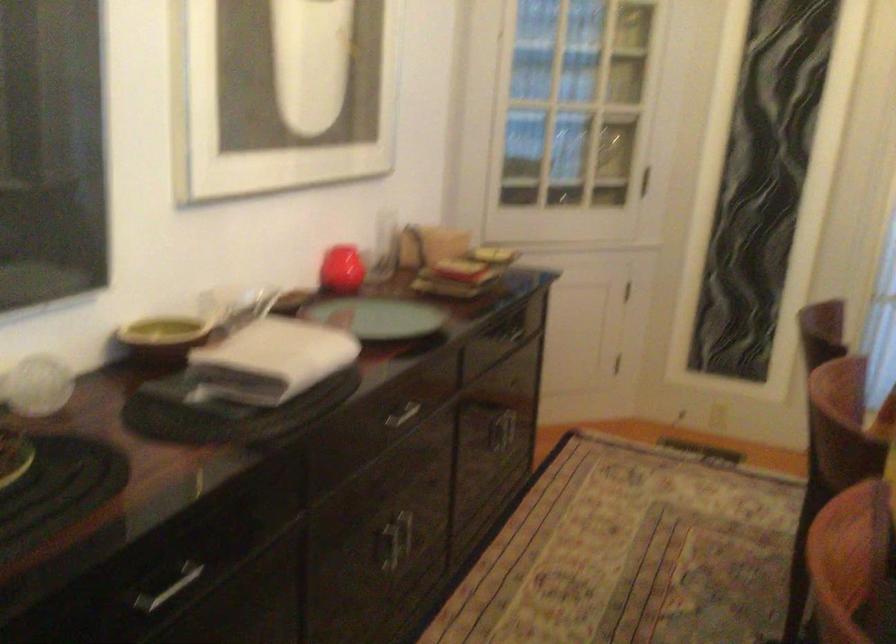
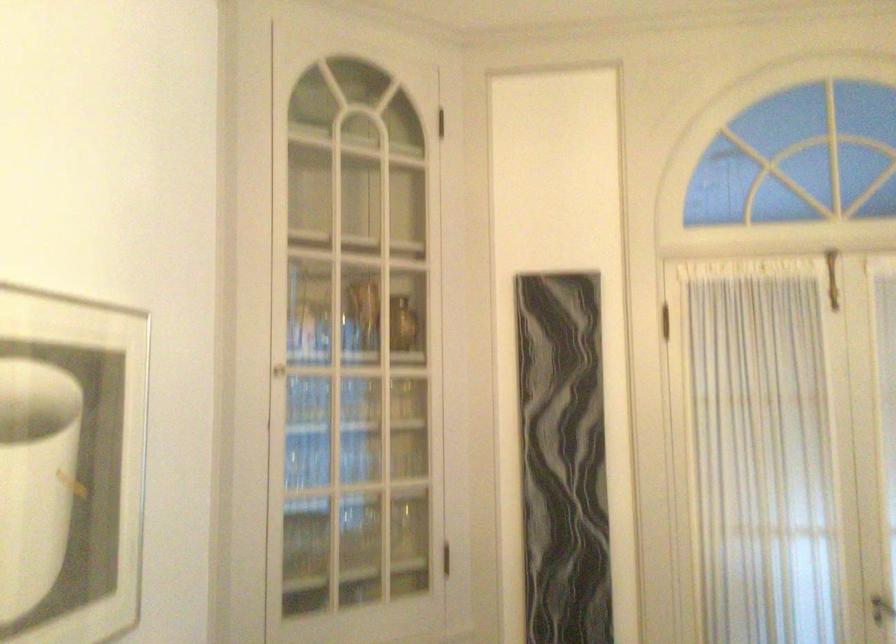
Question: Which direction would the cameraman need to move to produce the second image? Reply with the corresponding letter.

Choices:
 (A) Left
 (B) Right
 (C) Forward
 (D) Backward

Answer: (C)